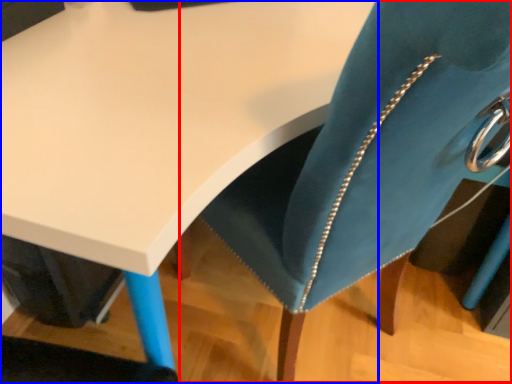
Question: Which object appears closest to the camera in this image, swivel chair (highlighted by a red box) or table (highlighted by a blue box)?

Choices:
 (A) swivel chair
 (B) table

Answer: (A)